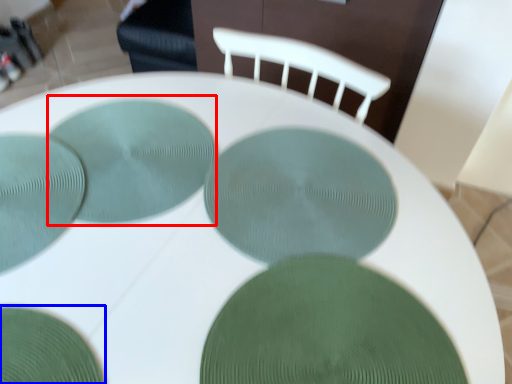
Question: Which object is closer to the camera taking this photo, glass plate (highlighted by a red box) or glass plate (highlighted by a blue box)?

Choices:
 (A) glass plate
 (B) glass plate

Answer: (B)